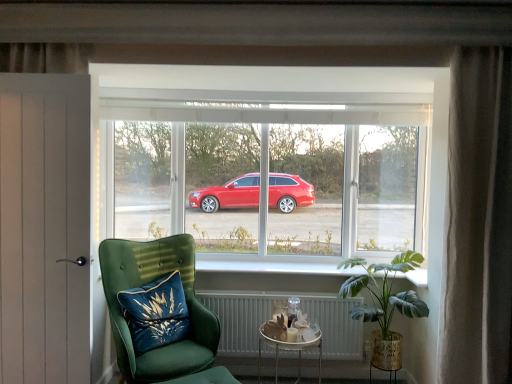
Question: Considering their positions, is white glossy window sill at center located in front of or behind transparent glass window at center?

Choices:
 (A) front
 (B) behind

Answer: (A)

Question: Looking at the image, does white glossy window sill at center seem bigger or smaller compared to transparent glass window at center?

Choices:
 (A) small
 (B) big

Answer: (A)

Question: Which object is the farthest from the transparent glass window at center?

Choices:
 (A) silky beige curtain at right
 (B) white glossy window sill at center
 (C) velvet green armchair at lower left
 (D) blue velvet cushion at lower left
 (E) green leafy plant at lower right

Answer: (D)

Question: Estimate the real-world distances between objects in this image. Which object is farther from the metallic silver tray at lower center?

Choices:
 (A) silky beige curtain at right
 (B) white metallic radiator at lower center
 (C) transparent glass window at center
 (D) green leafy plant at lower right
 (E) white painted wood door at left

Answer: (E)